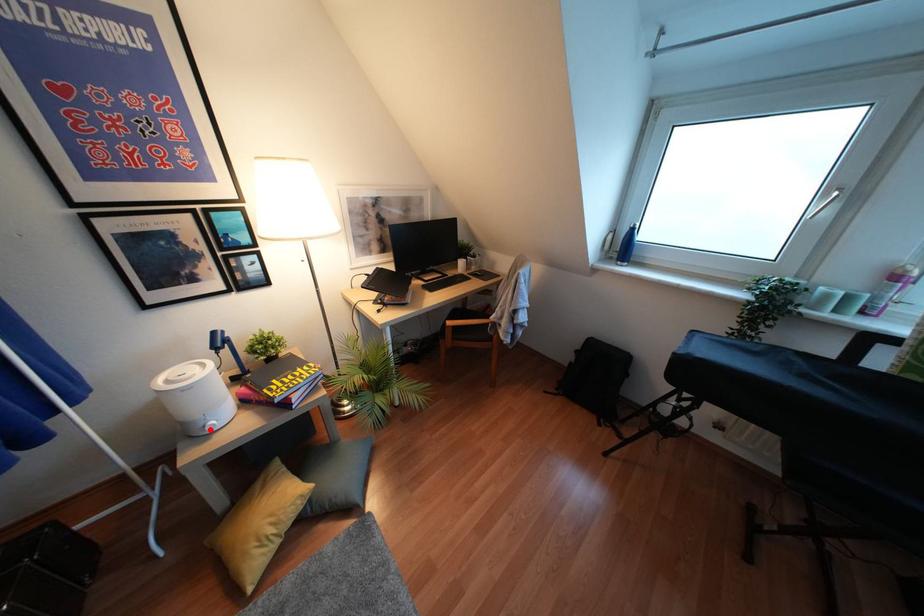
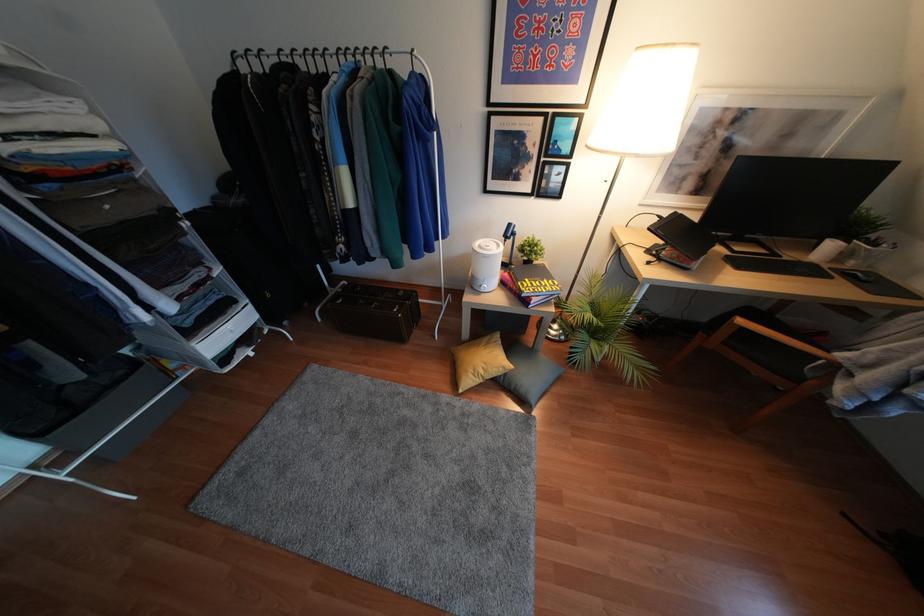
Locate, in the second image, the point that corresponds to the highlighted location in the first image.

(481, 290)